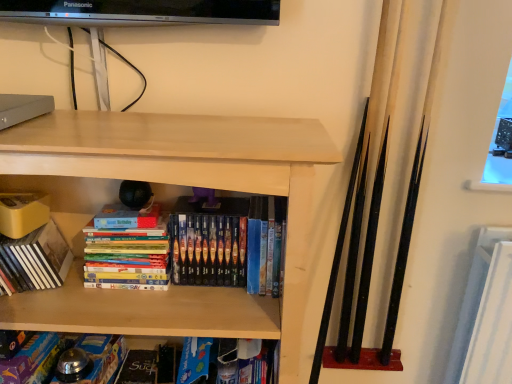
Question: Considering the positions of light wood shelf at center and multicolored cardboard books at center, placed as the third book when sorted from left to right, in the image, is light wood shelf at center wider or thinner than multicolored cardboard books at center, placed as the third book when sorted from left to right,?

Choices:
 (A) wide
 (B) thin

Answer: (A)

Question: Is point (49, 314) closer or farther from the camera than point (157, 284)?

Choices:
 (A) farther
 (B) closer

Answer: (B)

Question: Estimate the real-world distances between objects in this image. Which object is farther from the matte yellow book at left, arranged as the 1th book when viewed from the left?

Choices:
 (A) matte black paperback book at lower center
 (B) hardcover books at center, which appears as the 1th book when viewed from the right
 (C) blue cardboard book at lower center, arranged as the 2th book when viewed from the left
 (D) multicolored cardboard books at center, placed as the third book when sorted from left to right
 (E) light wood shelf at center

Answer: (A)

Question: Which is nearer to the matte yellow book at left, which is counted as the fourth book, starting from the right?

Choices:
 (A) light wood shelf at center
 (B) blue cardboard book at lower center, the third book positioned from the right
 (C) matte black paperback book at lower center
 (D) multicolored cardboard books at center, which is the 2th book in right-to-left order
 (E) hardcover books at center, which is counted as the 4th book, starting from the left

Answer: (D)